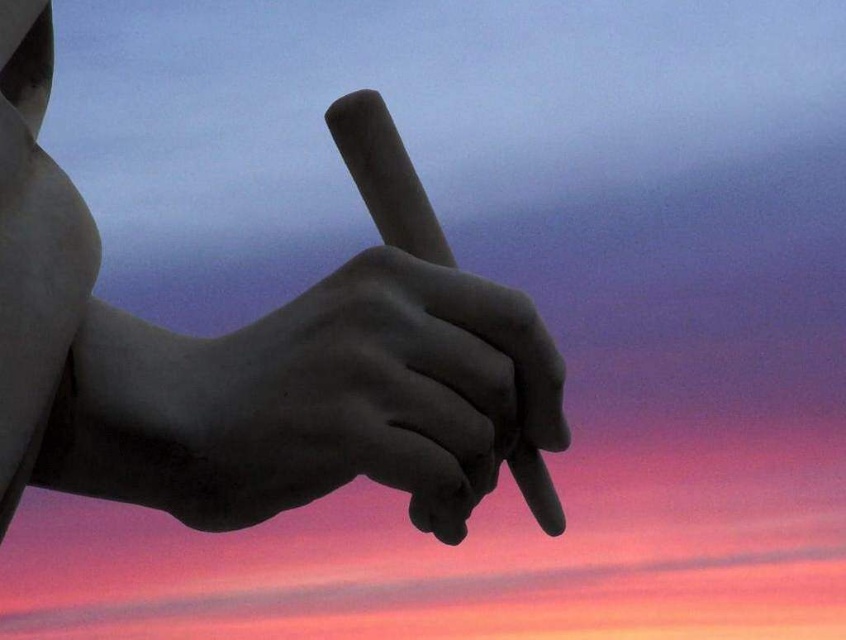
Can you confirm if matte gray pencil at center is thinner than matte black hand at center?

In fact, matte gray pencil at center might be wider than matte black hand at center.

Which is in front, point (551, 429) or point (257, 451)?

Positioned in front is point (257, 451).

At what (x,y) coordinates should I click in order to perform the action: click on matte gray pencil at center. Please return your answer as a coordinate pair (x, y). This screenshot has width=846, height=640. Looking at the image, I should click on (261, 355).